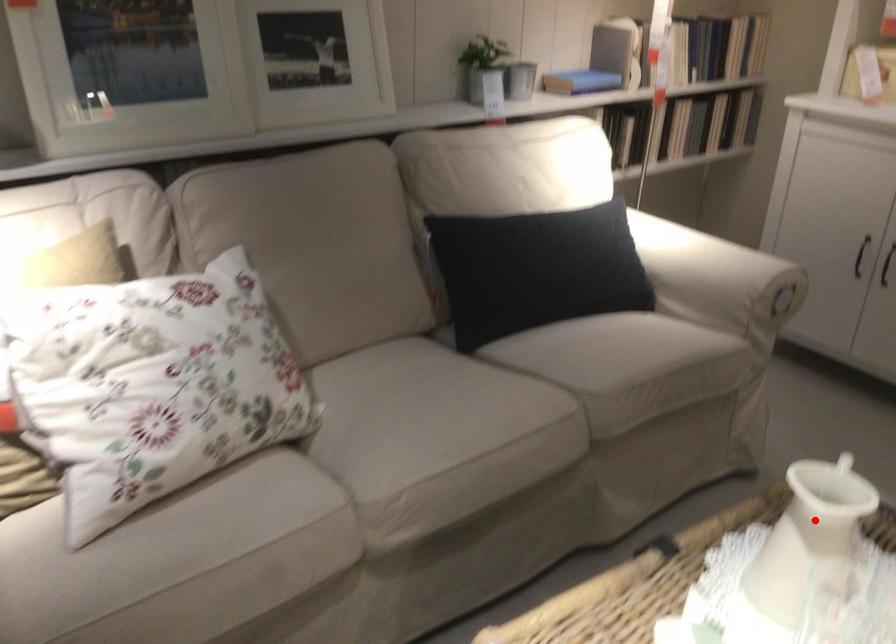
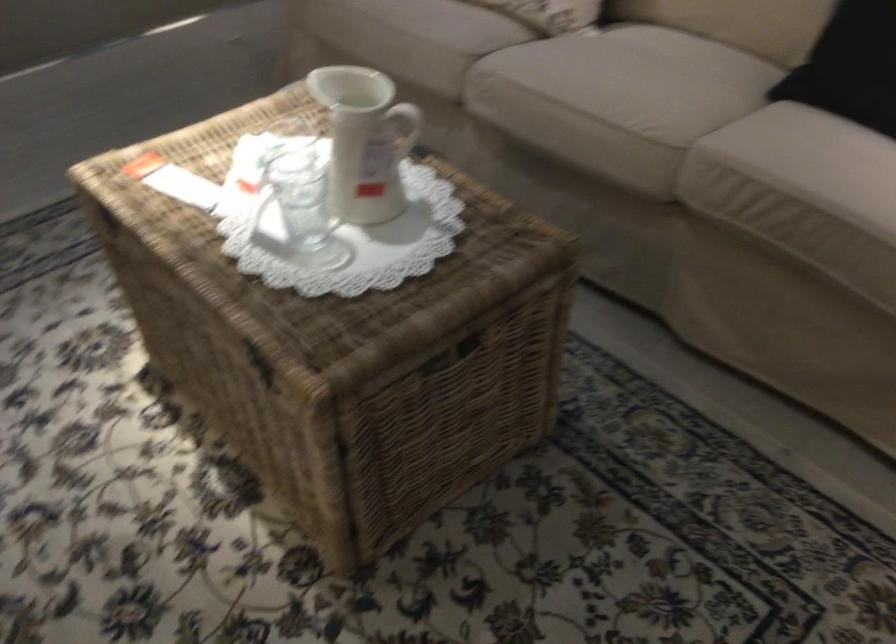
The point at the highlighted location is marked in the first image. Where is the corresponding point in the second image?

(365, 140)